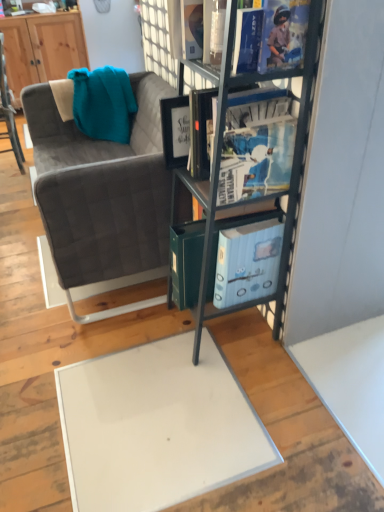
Question: From a real-world perspective, is metallic gray bookshelf at center physically above wooden cabinet at upper left?

Choices:
 (A) yes
 (B) no

Answer: (A)

Question: Considering the relative sizes of metallic gray bookshelf at center and wooden cabinet at upper left in the image provided, is metallic gray bookshelf at center taller than wooden cabinet at upper left?

Choices:
 (A) yes
 (B) no

Answer: (A)

Question: Considering the relative positions of metallic gray bookshelf at center and wooden cabinet at upper left in the image provided, is metallic gray bookshelf at center behind wooden cabinet at upper left?

Choices:
 (A) no
 (B) yes

Answer: (A)

Question: Are metallic gray bookshelf at center and wooden cabinet at upper left making contact?

Choices:
 (A) yes
 (B) no

Answer: (B)

Question: Considering the relative sizes of metallic gray bookshelf at center and wooden cabinet at upper left in the image provided, is metallic gray bookshelf at center bigger than wooden cabinet at upper left?

Choices:
 (A) yes
 (B) no

Answer: (B)

Question: From the image's perspective, is metallic gray bookshelf at center beneath wooden cabinet at upper left?

Choices:
 (A) yes
 (B) no

Answer: (A)

Question: Does velvet grey couch at left have a lesser height compared to velvet grey chair at left?

Choices:
 (A) yes
 (B) no

Answer: (A)

Question: Can you confirm if velvet grey couch at left is positioned to the right of velvet grey chair at left?

Choices:
 (A) yes
 (B) no

Answer: (A)

Question: From the image's perspective, is velvet grey couch at left below velvet grey chair at left?

Choices:
 (A) no
 (B) yes

Answer: (B)

Question: Does velvet grey couch at left have a larger size compared to velvet grey chair at left?

Choices:
 (A) yes
 (B) no

Answer: (A)

Question: Would you say velvet grey couch at left is outside velvet grey chair at left?

Choices:
 (A) no
 (B) yes

Answer: (B)

Question: Is velvet grey couch at left smaller than velvet grey chair at left?

Choices:
 (A) yes
 (B) no

Answer: (B)

Question: Does wooden cabinet at upper left appear on the right side of velvet grey couch at left?

Choices:
 (A) yes
 (B) no

Answer: (B)